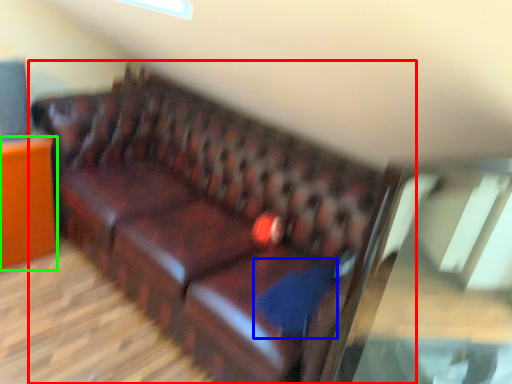
Question: Which object is the farthest from studio couch (highlighted by a red box)? Choose among these: pillow (highlighted by a blue box) or furniture (highlighted by a green box).

Choices:
 (A) pillow
 (B) furniture

Answer: (B)